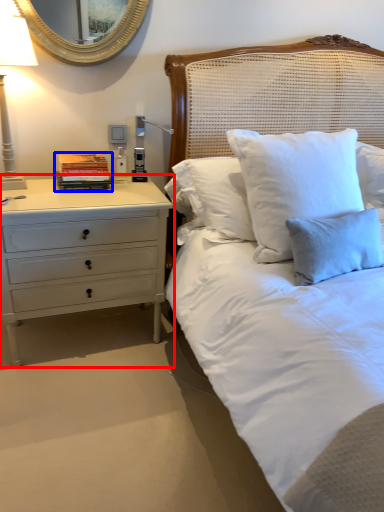
Question: Which of the following is the closest to the observer, chest of drawers (highlighted by a red box) or book (highlighted by a blue box)?

Choices:
 (A) chest of drawers
 (B) book

Answer: (A)